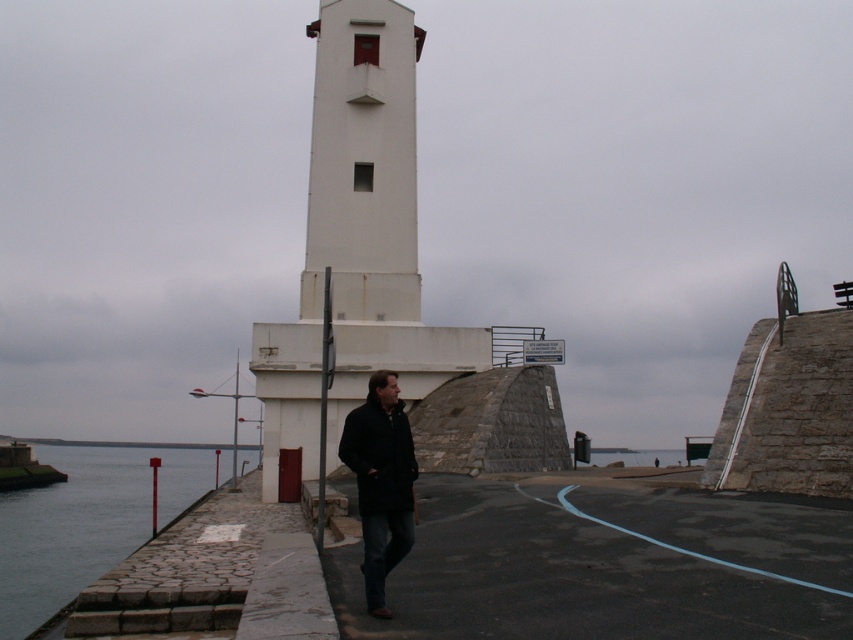
Looking at this image, you are standing on the curved pathway leading to the lighthouse and see the white smooth tower at center and the black matte coat at center. Which object is closer to you?

The black matte coat at center is closer to you because the white smooth tower at center is positioned over it, indicating it is further away.